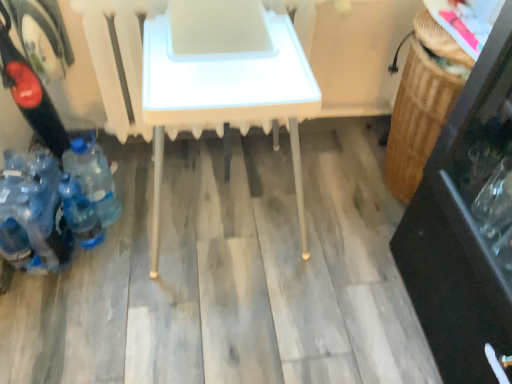
Question: Would you say blue plastic bottles at lower left, the 3th bottle positioned from the right, is outside white plastic table at center?

Choices:
 (A) no
 (B) yes

Answer: (B)

Question: Considering the relative sizes of blue plastic bottles at lower left, the first bottle in the left-to-right sequence, and white plastic table at center in the image provided, is blue plastic bottles at lower left, the first bottle in the left-to-right sequence, bigger than white plastic table at center?

Choices:
 (A) yes
 (B) no

Answer: (B)

Question: Would you say blue plastic bottles at lower left, the 3th bottle positioned from the right, contains white plastic table at center?

Choices:
 (A) yes
 (B) no

Answer: (B)

Question: Is blue plastic bottles at lower left, the first bottle in the left-to-right sequence, with white plastic table at center?

Choices:
 (A) yes
 (B) no

Answer: (B)

Question: From the image's perspective, is blue plastic bottles at lower left, the 3th bottle positioned from the right, on top of white plastic table at center?

Choices:
 (A) no
 (B) yes

Answer: (A)

Question: Considering the relative sizes of blue plastic bottles at lower left, the first bottle in the left-to-right sequence, and white plastic table at center in the image provided, is blue plastic bottles at lower left, the first bottle in the left-to-right sequence, thinner than white plastic table at center?

Choices:
 (A) no
 (B) yes

Answer: (B)

Question: Considering the relative positions of blue plastic bottle at lower left, the 2th bottle positioned from the right, and blue plastic bottle at lower left, arranged as the first bottle when viewed from the right, in the image provided, is blue plastic bottle at lower left, the 2th bottle positioned from the right, to the left of blue plastic bottle at lower left, arranged as the first bottle when viewed from the right, from the viewer's perspective?

Choices:
 (A) no
 (B) yes

Answer: (B)

Question: From a real-world perspective, is blue plastic bottle at lower left, the 2th bottle positioned from the right, positioned under blue plastic bottle at lower left, the 3th bottle positioned from the left, based on gravity?

Choices:
 (A) yes
 (B) no

Answer: (A)

Question: Is blue plastic bottle at lower left, which is counted as the second bottle, starting from the left, next to blue plastic bottle at lower left, arranged as the first bottle when viewed from the right, and touching it?

Choices:
 (A) no
 (B) yes

Answer: (A)

Question: Is blue plastic bottle at lower left, which is counted as the second bottle, starting from the left, looking in the opposite direction of blue plastic bottle at lower left, arranged as the first bottle when viewed from the right?

Choices:
 (A) yes
 (B) no

Answer: (A)

Question: Can you confirm if blue plastic bottle at lower left, which is counted as the second bottle, starting from the left, is taller than blue plastic bottle at lower left, the 3th bottle positioned from the left?

Choices:
 (A) yes
 (B) no

Answer: (B)

Question: Does blue plastic bottle at lower left, the 2th bottle positioned from the right, have a larger size compared to blue plastic bottle at lower left, the 3th bottle positioned from the left?

Choices:
 (A) no
 (B) yes

Answer: (A)

Question: From the image's perspective, is blue plastic bottle at lower left, the 2th bottle positioned from the right, on top of blue plastic bottles at lower left, the first bottle in the left-to-right sequence?

Choices:
 (A) no
 (B) yes

Answer: (A)